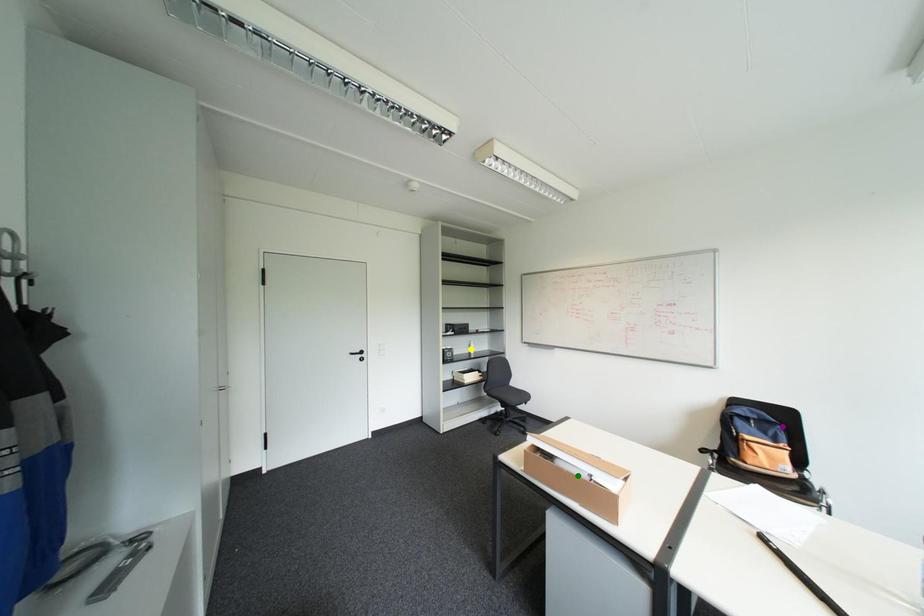
From the picture: Order these from nearest to farthest:
A) yellow point
B) purple point
C) green point

green point, purple point, yellow point